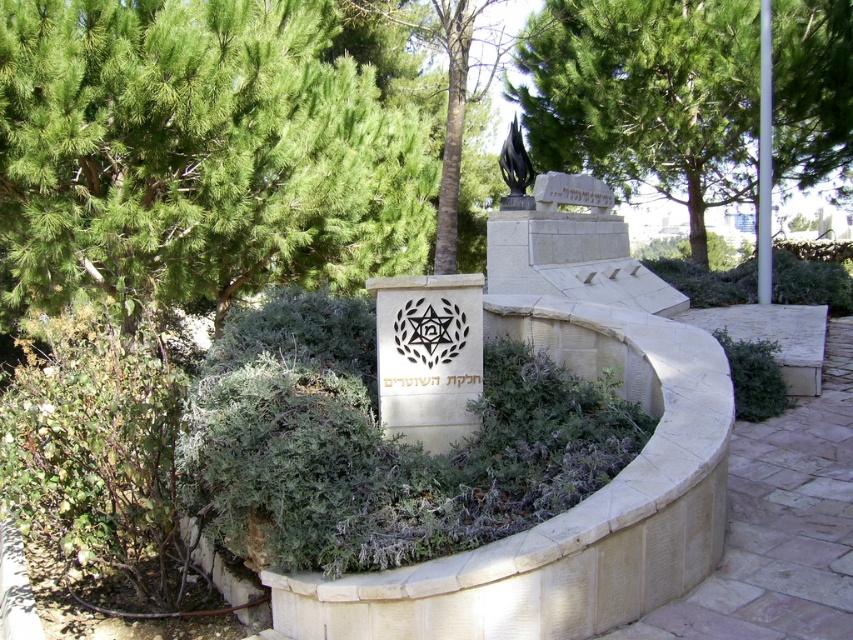
You are a landscape architect designing a new garden layout. You have two green leafy trees to place in the memorial area. The green leafy tree at upper center and the green leafy tree at center. Which tree should you choose if you want the wider tree to be placed in the central garden area?

The green leafy tree at upper center has a greater width than the green leafy tree at center, so you should choose the green leafy tree at upper center to place in the central garden area if you want the wider tree there.

You are standing in front of the memorial structure. You see a green leafy tree at center and a black glossy sculpture at upper center. Which object is positioned to the left of the other?

The green leafy tree at center is to the left of the black glossy sculpture at upper center.

You are standing at the entrance of the memorial and want to take a photo of the green leafy tree at center. Which direction should you face to ensure the tree is in the center of your photo?

The green leafy tree at center is located at point coordinates, so you should face directly towards the center of the memorial structure to capture it in the center of your photo.